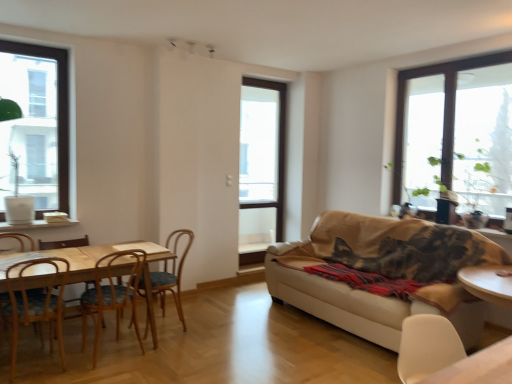
Identify the location of unoccupied region to the right of wooden table at left. (207, 349).